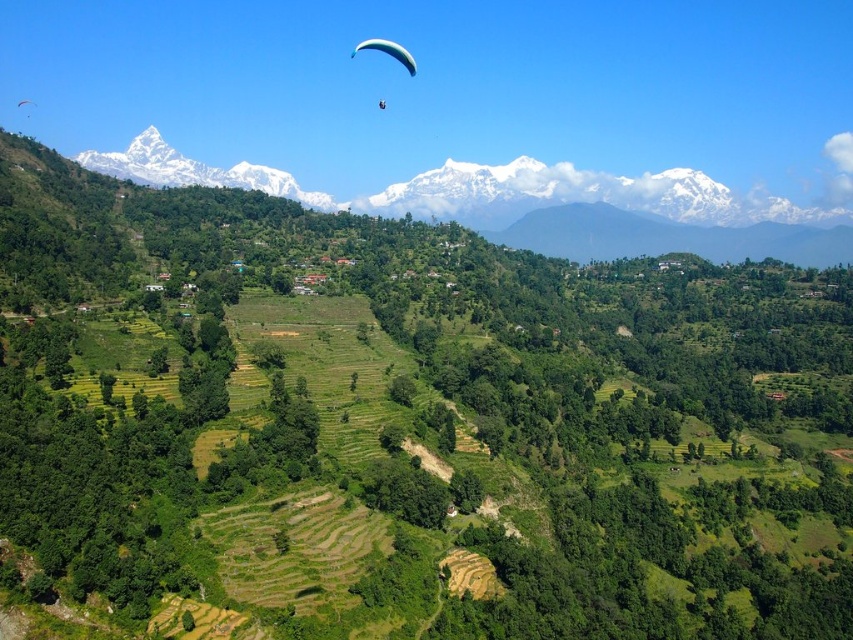
You are a drone operator flying over the valley. You need to navigate between two points marked as point 1 at coordinates point (x=91, y=168) and point 2 at coordinates point (x=399, y=56). Which point is closer to your current position?

Point (x=91, y=168) is closer to your current position because it is further to the viewer than point (x=399, y=56).